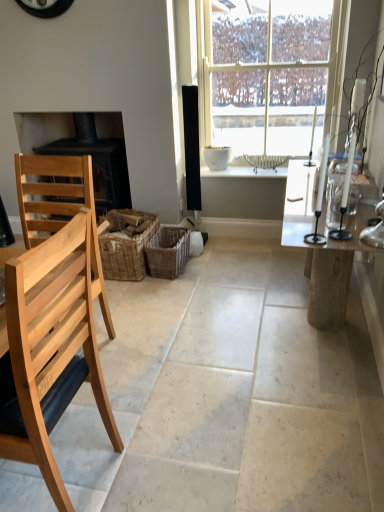
Locate an element on the screen. The width and height of the screenshot is (384, 512). empty space that is in between natural wood chair at left, acting as the second chair starting from the back, and clear glass table at right is located at coordinates (x=213, y=370).